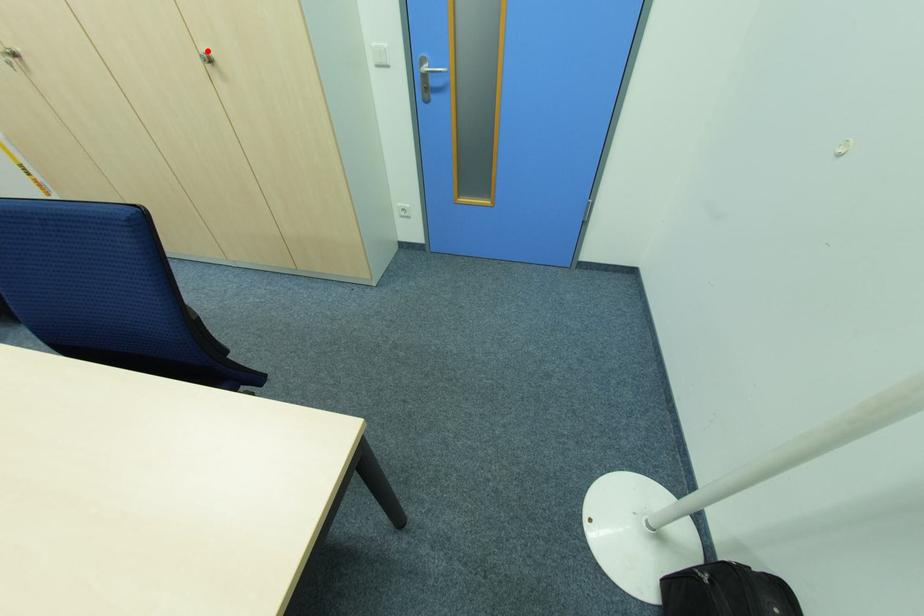
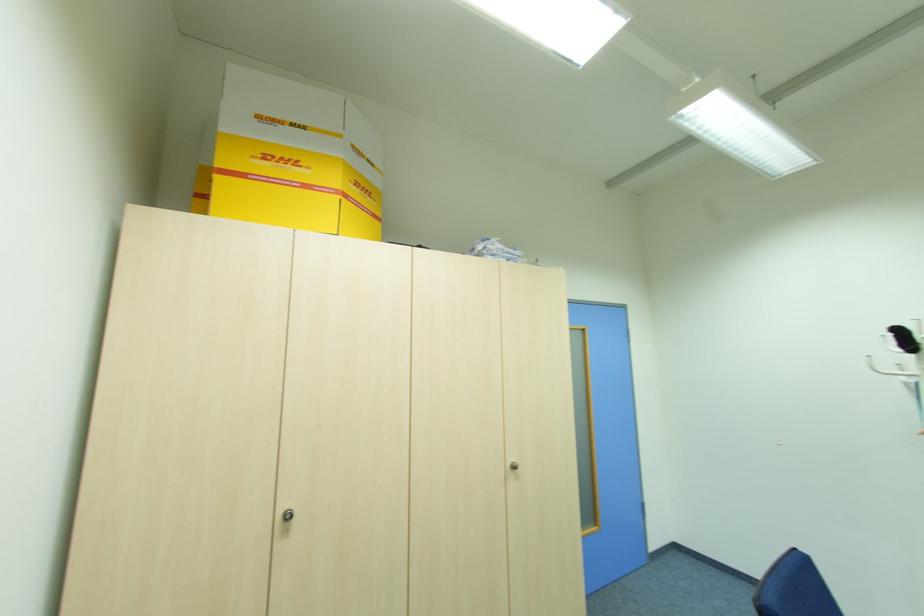
Where in the second image is the point corresponding to the highlighted location from the first image?

(513, 460)